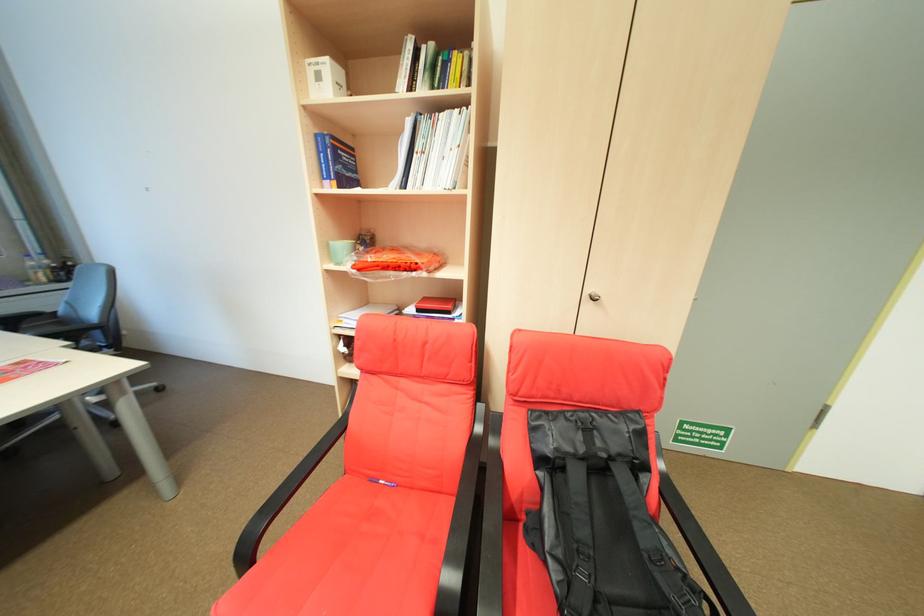
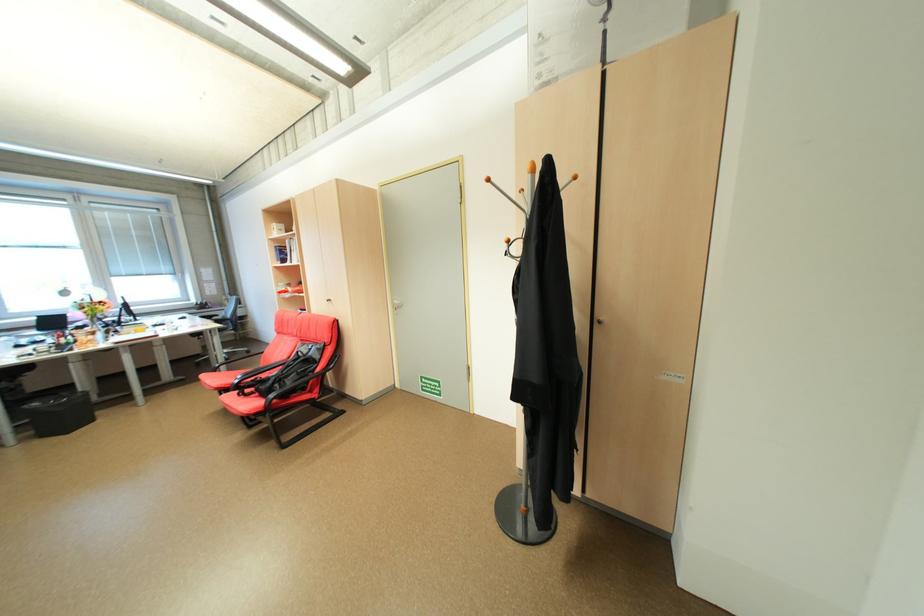
Find the pixel in the second image that matches point (168, 390) in the first image.

(257, 353)